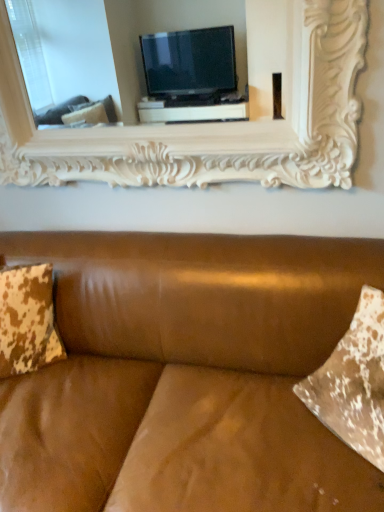
Question: Is brown leather couch at center inside the boundaries of white carved wood picture frame at upper center, or outside?

Choices:
 (A) inside
 (B) outside

Answer: (B)

Question: In terms of size, does brown leather couch at center appear bigger or smaller than white carved wood picture frame at upper center?

Choices:
 (A) small
 (B) big

Answer: (B)

Question: Estimate the real-world distances between objects in this image. Which object is farther from the white carved wood picture frame at upper center?

Choices:
 (A) brown leather couch at center
 (B) brown distressed fabric pillow at left

Answer: (B)

Question: Based on their relative distances, which object is farther from the white carved wood picture frame at upper center?

Choices:
 (A) brown leather couch at center
 (B) brown distressed fabric pillow at left

Answer: (B)